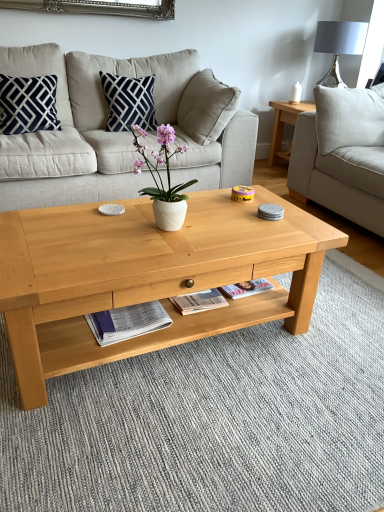
What are the coordinates of `vacant space to the left of white matte vase at center` in the screenshot? It's located at (107, 232).